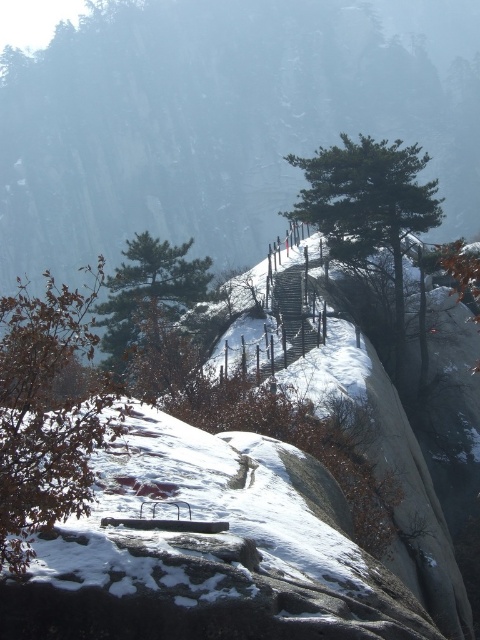
Is brown matte tree at lower left below green matte tree at upper center?

Correct, brown matte tree at lower left is located below green matte tree at upper center.

Who is more forward, (x=4, y=538) or (x=354, y=186)?

Point (x=4, y=538)

I want to click on brown matte tree at lower left, so click(48, 410).

Which is above, brown matte tree at lower left or green matte tree at center?

green matte tree at center is above.

Is point (43, 330) farther from viewer compared to point (149, 236)?

No, it is in front of (149, 236).

Does point (13, 355) lie in front of point (142, 300)?

Yes, point (13, 355) is closer to viewer.

At what (x,y) coordinates should I click in order to perform the action: click on brown matte tree at lower left. Please return your answer as a coordinate pair (x, y). The image size is (480, 640). Looking at the image, I should click on (48, 410).

Is green matte tree at upper center behind green matte tree at center?

Yes, it is.

Describe the element at coordinates (368, 202) in the screenshot. This screenshot has height=640, width=480. I see `green matte tree at upper center` at that location.

The width and height of the screenshot is (480, 640). Identify the location of green matte tree at upper center. (368, 202).

This screenshot has height=640, width=480. In order to click on green matte tree at upper center in this screenshot , I will do `click(368, 202)`.